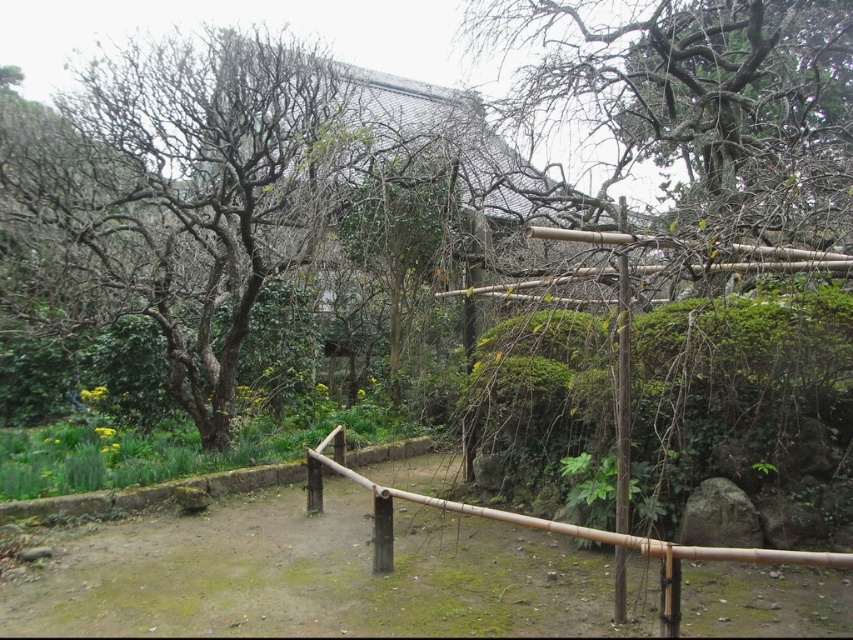
Question: Is bare wood tree at left thinner than bamboo pole at center?

Choices:
 (A) yes
 (B) no

Answer: (B)

Question: In this image, where is bare wood tree at left located relative to bamboo pole at center?

Choices:
 (A) right
 (B) left

Answer: (B)

Question: Which of the following is the closest to the observer?

Choices:
 (A) bamboo fence at center
 (B) bare wood tree at left

Answer: (A)

Question: Does bare wood tree at left lie in front of bamboo fence at center?

Choices:
 (A) yes
 (B) no

Answer: (B)

Question: Which point is farther to the camera?

Choices:
 (A) bamboo fence at center
 (B) bare wood tree at left
 (C) bamboo pole at center

Answer: (B)

Question: Which is farther from the bare wood tree at left?

Choices:
 (A) bamboo pole at center
 (B) bamboo fence at center

Answer: (B)